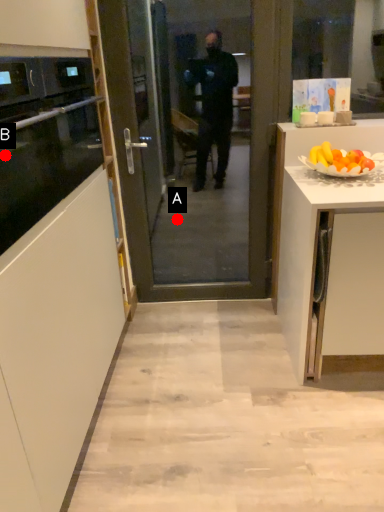
Question: Two points are circled on the image, labeled by A and B beside each circle. Which point is closer to the camera?

Choices:
 (A) A is closer
 (B) B is closer

Answer: (B)